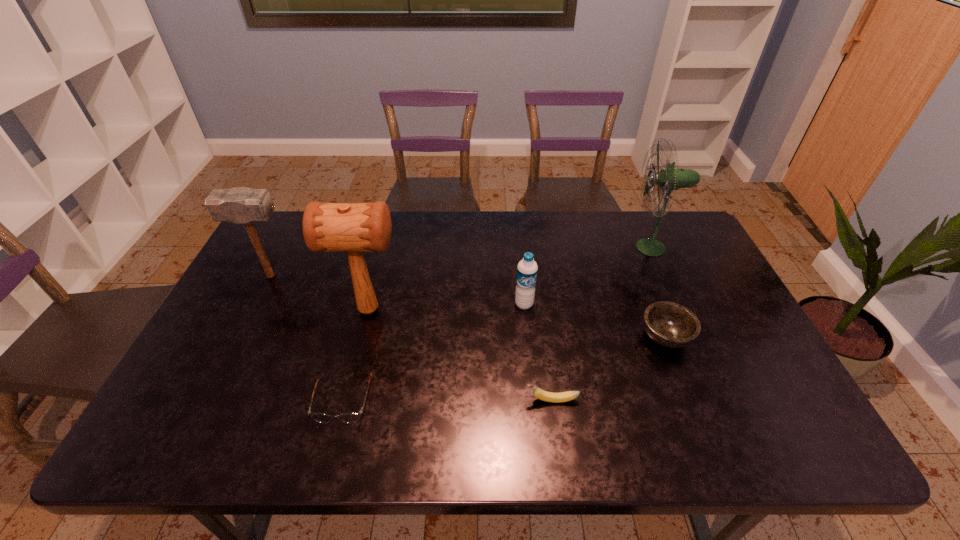
Where is `fan`? This screenshot has width=960, height=540. fan is located at coordinates (668, 179).

In order to click on the taller mallet in this screenshot , I will do `click(327, 227)`.

This screenshot has height=540, width=960. Identify the location of the right mallet. (327, 227).

Find the location of a particular element. Image resolution: width=960 pixels, height=540 pixels. the third tallest object is located at coordinates (240, 205).

This screenshot has width=960, height=540. I want to click on the leftmost object, so click(x=240, y=205).

What are the coordinates of `the fourth tallest object` in the screenshot? It's located at (527, 268).

Identify the location of bowl. (671, 325).

Where is `banana`? The image size is (960, 540). banana is located at coordinates (x=543, y=395).

The width and height of the screenshot is (960, 540). Identify the location of the shortest object. (352, 417).

Where is `free space located on the front-facing side of the fan`? This screenshot has height=540, width=960. free space located on the front-facing side of the fan is located at coordinates (585, 247).